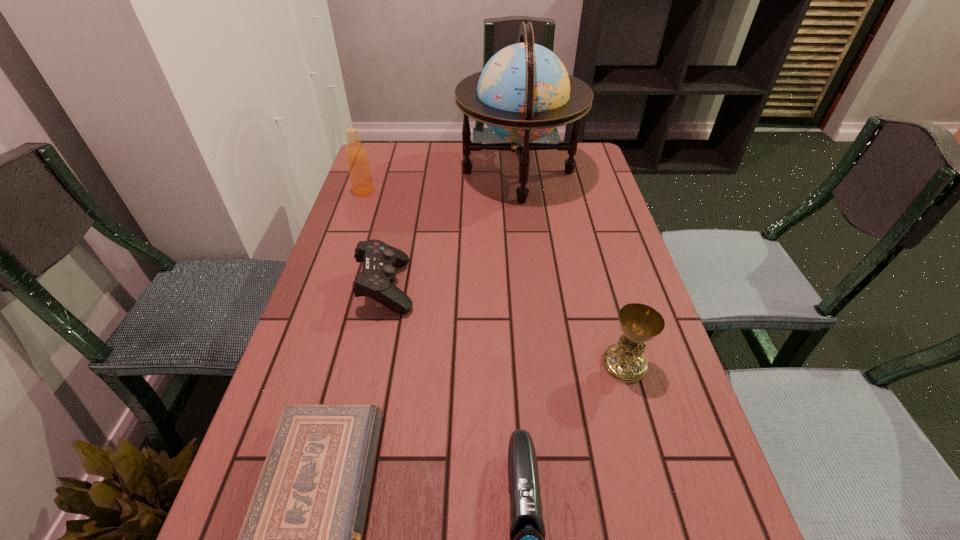
This screenshot has width=960, height=540. What are the coordinates of `object that is the fifth closest one to the Bible` in the screenshot? It's located at (356, 155).

The image size is (960, 540). Identify the location of free point that satisfies the following two spatial constraints: 1. on the surface of the chalice; 2. on the right side of the tallest object. (540, 364).